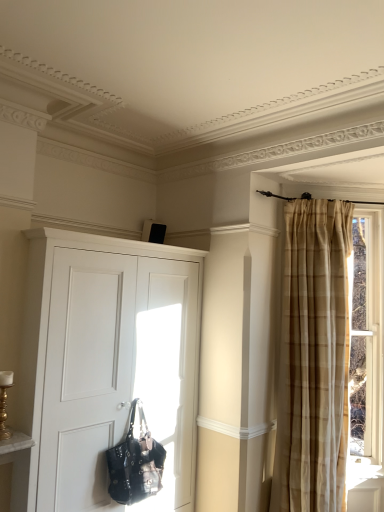
Question: Is white matte cupboard at center placed right next to brown plaid curtain at right?

Choices:
 (A) no
 (B) yes

Answer: (A)

Question: Can you confirm if white matte cupboard at center is taller than brown plaid curtain at right?

Choices:
 (A) no
 (B) yes

Answer: (B)

Question: From a real-world perspective, does white matte cupboard at center sit lower than brown plaid curtain at right?

Choices:
 (A) yes
 (B) no

Answer: (A)

Question: Is the depth of white matte cupboard at center less than that of brown plaid curtain at right?

Choices:
 (A) yes
 (B) no

Answer: (A)

Question: Is white matte cupboard at center oriented towards brown plaid curtain at right?

Choices:
 (A) no
 (B) yes

Answer: (A)

Question: In terms of width, does shiny black leather handbag at lower left look wider or thinner when compared to white matte cupboard at center?

Choices:
 (A) wide
 (B) thin

Answer: (B)

Question: Considering the positions of shiny black leather handbag at lower left and white matte cupboard at center in the image, is shiny black leather handbag at lower left taller or shorter than white matte cupboard at center?

Choices:
 (A) short
 (B) tall

Answer: (A)

Question: From the image's perspective, is shiny black leather handbag at lower left positioned above or below white matte cupboard at center?

Choices:
 (A) below
 (B) above

Answer: (A)

Question: Is point (147, 492) positioned closer to the camera than point (173, 264)?

Choices:
 (A) closer
 (B) farther

Answer: (A)

Question: Is white matte cupboard at center wider or thinner than brown plaid curtain at right?

Choices:
 (A) thin
 (B) wide

Answer: (B)

Question: Is white matte cupboard at center inside the boundaries of brown plaid curtain at right, or outside?

Choices:
 (A) outside
 (B) inside

Answer: (A)

Question: Would you say white matte cupboard at center is to the left or to the right of brown plaid curtain at right in the picture?

Choices:
 (A) left
 (B) right

Answer: (A)

Question: Is white matte cupboard at center in front of or behind brown plaid curtain at right in the image?

Choices:
 (A) front
 (B) behind

Answer: (A)

Question: From the image's perspective, is white matte cupboard at center located above or below shiny black leather handbag at lower left?

Choices:
 (A) below
 (B) above

Answer: (B)

Question: In terms of size, does white matte cupboard at center appear bigger or smaller than shiny black leather handbag at lower left?

Choices:
 (A) big
 (B) small

Answer: (A)